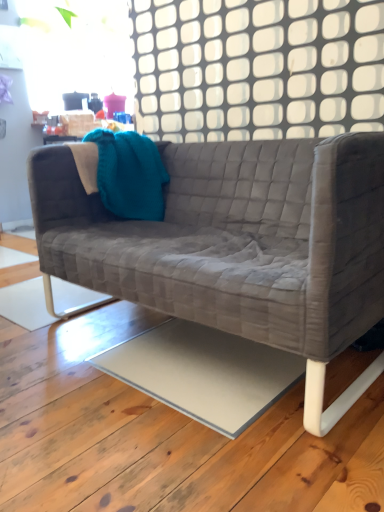
Question: Is teal knitted throw pillow at upper left looking in the opposite direction of white grid at upper center?

Choices:
 (A) no
 (B) yes

Answer: (A)

Question: Is teal knitted throw pillow at upper left shorter than white grid at upper center?

Choices:
 (A) no
 (B) yes

Answer: (B)

Question: Is the position of teal knitted throw pillow at upper left more distant than that of white grid at upper center?

Choices:
 (A) yes
 (B) no

Answer: (A)

Question: Does teal knitted throw pillow at upper left lie in front of white grid at upper center?

Choices:
 (A) no
 (B) yes

Answer: (A)

Question: Considering the relative sizes of teal knitted throw pillow at upper left and white grid at upper center in the image provided, is teal knitted throw pillow at upper left bigger than white grid at upper center?

Choices:
 (A) no
 (B) yes

Answer: (B)

Question: Is white grid at upper center spatially inside velvet grey couch at center, or outside of it?

Choices:
 (A) inside
 (B) outside

Answer: (B)

Question: Considering the positions of white grid at upper center and velvet grey couch at center in the image, is white grid at upper center wider or thinner than velvet grey couch at center?

Choices:
 (A) thin
 (B) wide

Answer: (A)

Question: Is white grid at upper center taller or shorter than velvet grey couch at center?

Choices:
 (A) tall
 (B) short

Answer: (B)

Question: Relative to velvet grey couch at center, is white grid at upper center in front or behind?

Choices:
 (A) front
 (B) behind

Answer: (B)

Question: Is velvet grey couch at center in front of or behind white grid at upper center in the image?

Choices:
 (A) front
 (B) behind

Answer: (A)

Question: From a real-world perspective, is velvet grey couch at center physically located above or below white grid at upper center?

Choices:
 (A) above
 (B) below

Answer: (B)

Question: From the image's perspective, is velvet grey couch at center positioned above or below white grid at upper center?

Choices:
 (A) above
 (B) below

Answer: (B)

Question: Is velvet grey couch at center to the left or to the right of white grid at upper center in the image?

Choices:
 (A) right
 (B) left

Answer: (B)

Question: From a real-world perspective, is velvet grey couch at center physically located above or below teal knitted throw pillow at upper left?

Choices:
 (A) above
 (B) below

Answer: (B)

Question: Based on their sizes in the image, would you say velvet grey couch at center is bigger or smaller than teal knitted throw pillow at upper left?

Choices:
 (A) big
 (B) small

Answer: (A)